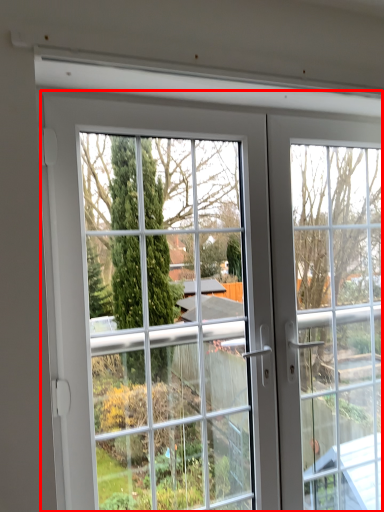
Question: Where is door (annotated by the red box) located in relation to window frame in the image?

Choices:
 (A) right
 (B) left

Answer: (B)